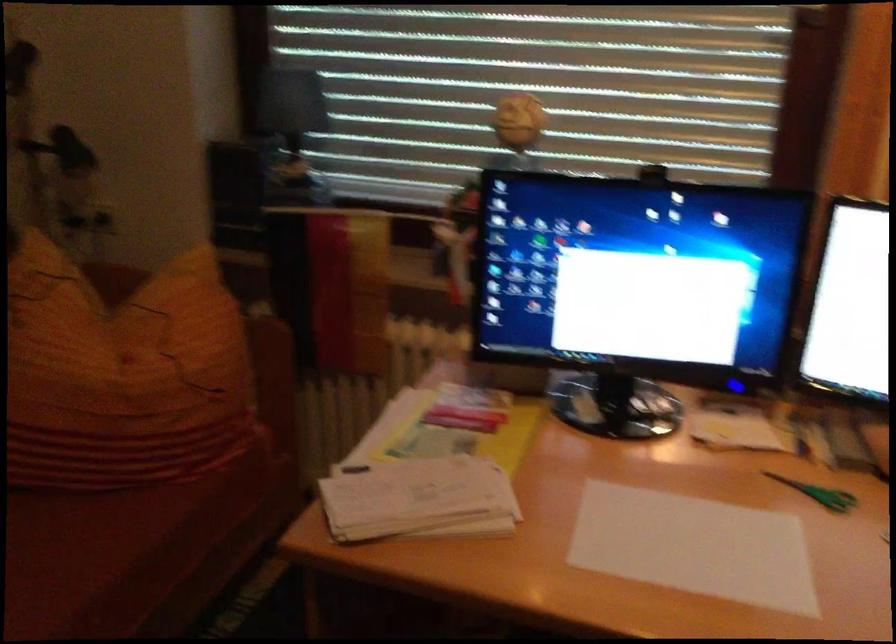
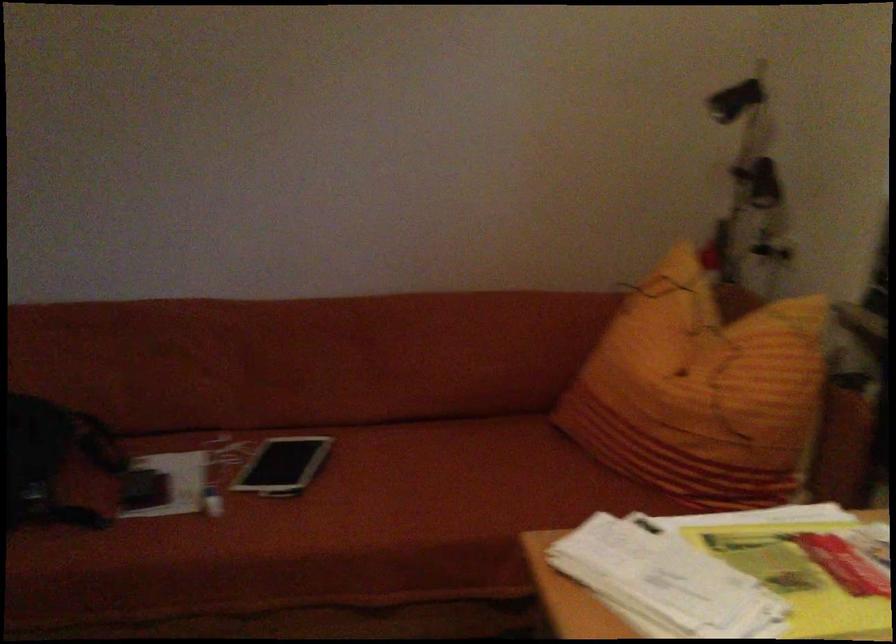
Question: How did the camera likely rotate?

Choices:
 (A) Left
 (B) Right
 (C) Up
 (D) Down

Answer: (A)